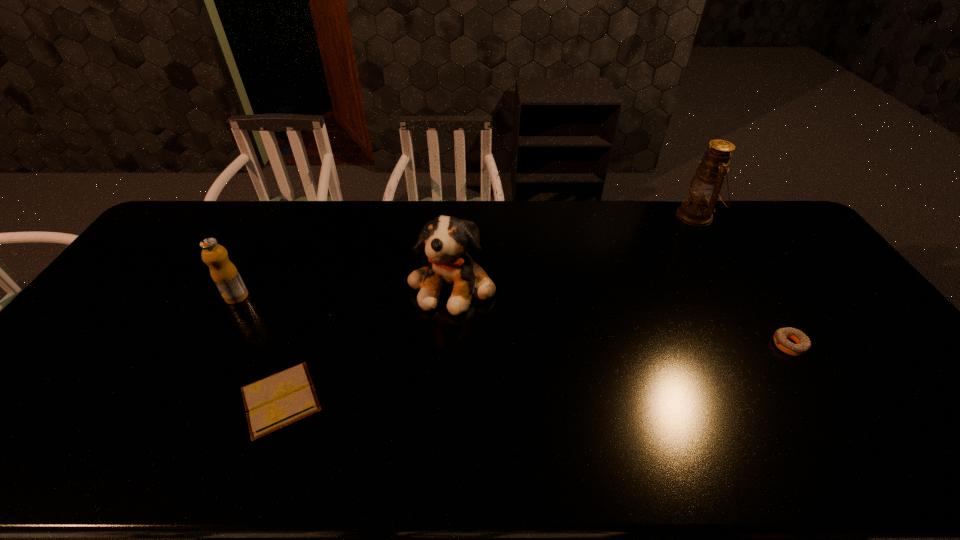
Image resolution: width=960 pixels, height=540 pixels. Find the location of `free region located 0.180m on the front label of the fruit juice`. free region located 0.180m on the front label of the fruit juice is located at coordinates (204, 356).

The height and width of the screenshot is (540, 960). I want to click on vacant area situated on the right of the doughnut, so click(x=858, y=345).

This screenshot has height=540, width=960. What are the coordinates of `free space located on the back of the nearest object` in the screenshot? It's located at (318, 298).

You are a GUI agent. You are given a task and a screenshot of the screen. Output one action in this format:
    pyautogui.click(x=<x>, y=<y>)
    Task: Click on the object that is positioned at the far edge
    
    Given the screenshot: What is the action you would take?
    pyautogui.click(x=704, y=189)

I want to click on object located at the near edge, so click(277, 401).

This screenshot has height=540, width=960. In the image, there is a desktop. In order to click on vacant space at the far edge in this screenshot , I will do `click(470, 202)`.

I want to click on blank space at the near edge of the desktop, so click(x=762, y=435).

Find the location of a particular element. The height and width of the screenshot is (540, 960). vacant space at the left edge of the desktop is located at coordinates click(x=127, y=321).

Locate an element on the screen. free space at the right edge of the desktop is located at coordinates (882, 361).

What are the coordinates of `free spot at the far right corner of the desktop` in the screenshot? It's located at (791, 234).